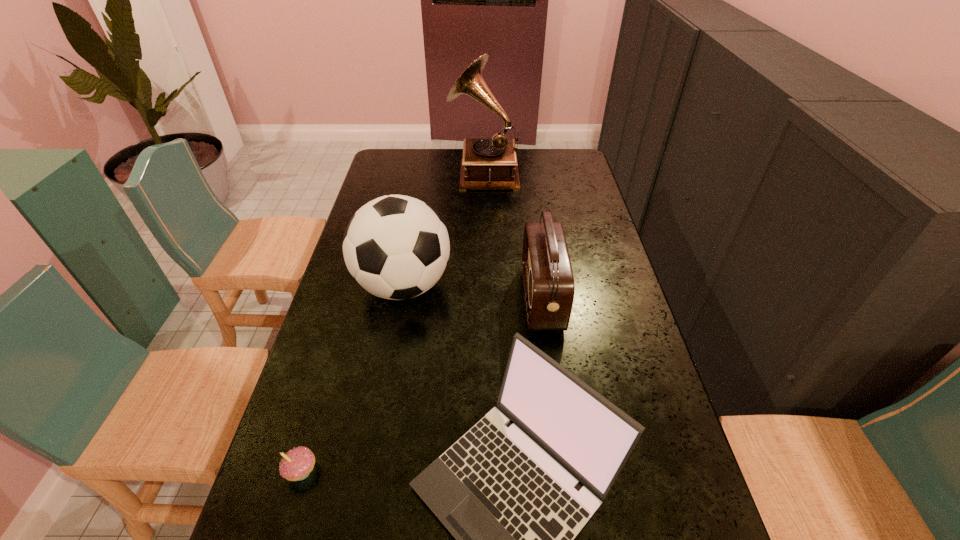
The width and height of the screenshot is (960, 540). Identify the location of vacant area situated 0.210m on the front panel of the radio receiver. (450, 299).

Where is `vacant area situated on the front panel of the radio receiver`? This screenshot has height=540, width=960. vacant area situated on the front panel of the radio receiver is located at coordinates (461, 299).

This screenshot has height=540, width=960. What are the coordinates of `free space located 0.090m on the back of the cupcake` in the screenshot? It's located at (318, 416).

In order to click on object at the far edge in this screenshot , I will do `click(492, 163)`.

Locate an element on the screen. Image resolution: width=960 pixels, height=540 pixels. soccer ball that is at the left edge is located at coordinates (396, 247).

At what (x,y) coordinates should I click in order to perform the action: click on cupcake located in the left edge section of the desktop. Please return your answer as a coordinate pair (x, y). The height and width of the screenshot is (540, 960). Looking at the image, I should click on [296, 465].

In the image, there is a desktop. Where is `free space at the left edge`? This screenshot has width=960, height=540. free space at the left edge is located at coordinates (346, 324).

This screenshot has width=960, height=540. Identify the location of free space at the right edge of the desktop. (551, 190).

Find the location of `vacant position at the far left corner of the desktop`. vacant position at the far left corner of the desktop is located at coordinates (417, 164).

Locate an element on the screen. The height and width of the screenshot is (540, 960). free space at the far right corner of the desktop is located at coordinates (552, 155).